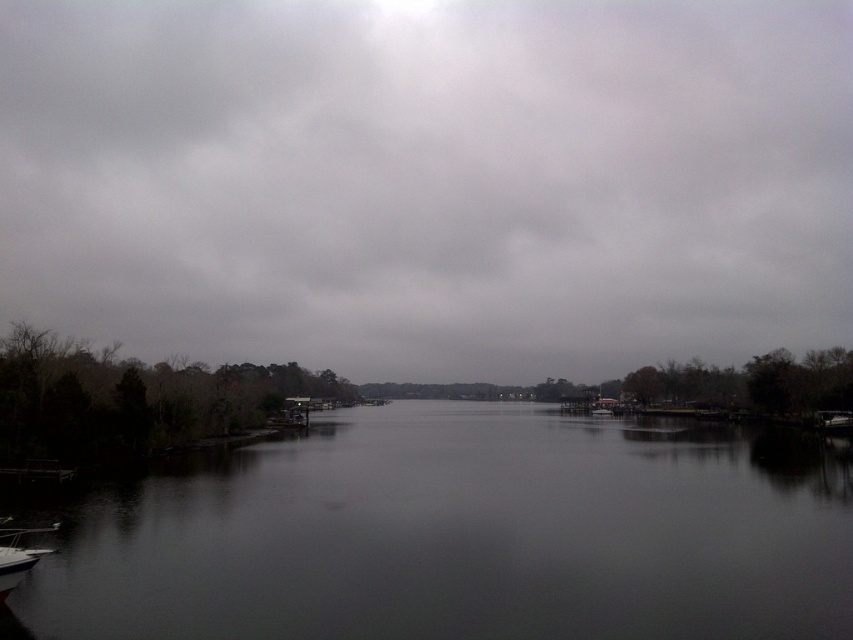
Is gray cloudy sky at upper center smaller than white glossy boat at lower left?

No, gray cloudy sky at upper center is not smaller than white glossy boat at lower left.

Which is more to the left, gray cloudy sky at upper center or white glossy boat at lower left?

white glossy boat at lower left is more to the left.

Image resolution: width=853 pixels, height=640 pixels. Identify the location of gray cloudy sky at upper center. (428, 180).

Who is shorter, gray cloudy sky at upper center or dark water at center?

dark water at center is shorter.

Which is more to the right, gray cloudy sky at upper center or dark water at center?

dark water at center

Locate an element on the screen. gray cloudy sky at upper center is located at coordinates (428, 180).

Between dark water at center and white glossy boat at lower left, which one has less height?

white glossy boat at lower left is shorter.

Where is `dark water at center`? The image size is (853, 640). dark water at center is located at coordinates (466, 534).

Measure the distance between dark water at center and camera.

They are 12.95 meters apart.

In order to click on dark water at center in this screenshot , I will do `click(466, 534)`.